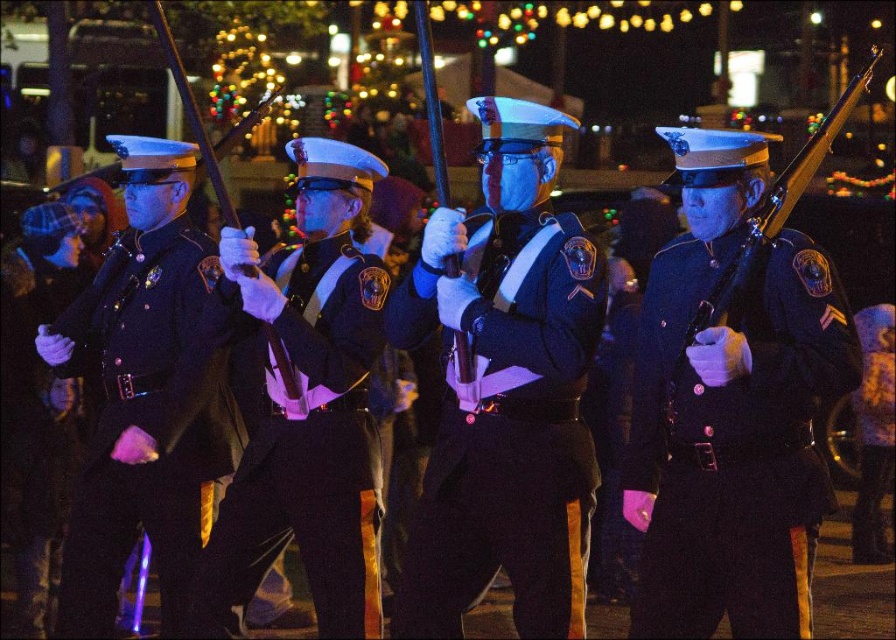
Question: Which of the following is the closest to the observer?

Choices:
 (A) dark blue fabric uniform at right
 (B) wooden rifle at right
 (C) matte black uniform at left

Answer: (A)

Question: Is dark blue fabric uniform at left above matte black uniform at left?

Choices:
 (A) no
 (B) yes

Answer: (B)

Question: Does dark blue fabric uniform at right have a larger size compared to wooden rifle at right?

Choices:
 (A) yes
 (B) no

Answer: (A)

Question: Is dark blue fabric uniform at right in front of satin black uniform at center?

Choices:
 (A) yes
 (B) no

Answer: (A)

Question: Which point appears farthest from the camera in this image?

Choices:
 (A) (468, 550)
 (B) (824, 138)
 (C) (9, 508)
 (D) (276, 513)

Answer: (C)

Question: Which of the following is the closest to the observer?

Choices:
 (A) (194, 300)
 (B) (876, 51)
 (C) (640, 620)

Answer: (C)